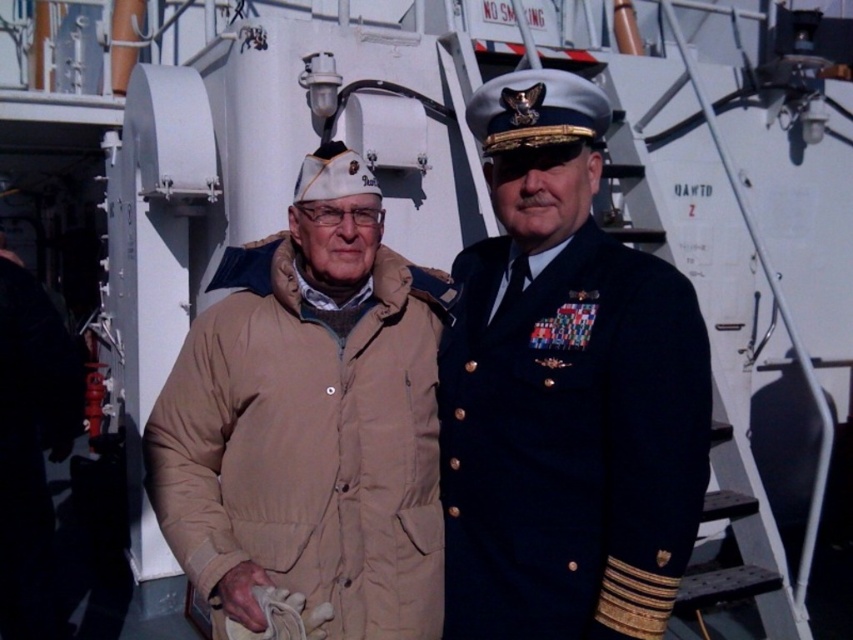
Question: Can you confirm if tan fabric jacket at center is positioned to the right of tan quilted jacket at center?

Choices:
 (A) yes
 (B) no

Answer: (A)

Question: Among these objects, which one is farthest from the camera?

Choices:
 (A) tan quilted jacket at center
 (B) tan fabric jacket at center
 (C) navy blue woolen jacket at center

Answer: (A)

Question: In this image, where is navy blue woolen jacket at center located relative to tan quilted jacket at center?

Choices:
 (A) below
 (B) above

Answer: (B)

Question: Considering the relative positions of navy blue woolen jacket at center and tan quilted jacket at center in the image provided, where is navy blue woolen jacket at center located with respect to tan quilted jacket at center?

Choices:
 (A) below
 (B) above

Answer: (B)

Question: Which is nearer to the tan quilted jacket at center?

Choices:
 (A) navy blue woolen jacket at center
 (B) tan fabric jacket at center

Answer: (B)

Question: Among these objects, which one is farthest from the camera?

Choices:
 (A) tan quilted jacket at center
 (B) navy blue woolen jacket at center
 (C) tan fabric jacket at center

Answer: (A)